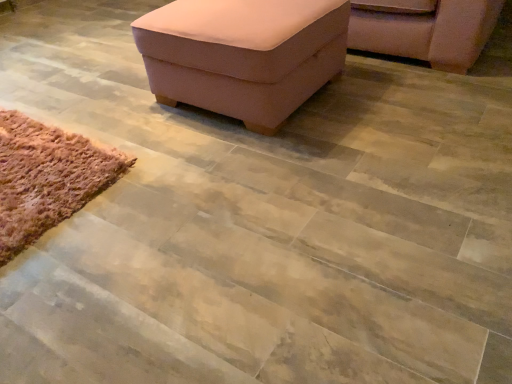
Question: Considering the relative positions of pink fabric ottoman at upper center and pink fabric chair at upper right in the image provided, is pink fabric ottoman at upper center to the left of pink fabric chair at upper right from the viewer's perspective?

Choices:
 (A) yes
 (B) no

Answer: (A)

Question: Is pink fabric ottoman at upper center to the right of pink fabric chair at upper right from the viewer's perspective?

Choices:
 (A) yes
 (B) no

Answer: (B)

Question: Considering the relative sizes of pink fabric ottoman at upper center and pink fabric chair at upper right in the image provided, is pink fabric ottoman at upper center wider than pink fabric chair at upper right?

Choices:
 (A) yes
 (B) no

Answer: (B)

Question: Is pink fabric ottoman at upper center turned away from pink fabric chair at upper right?

Choices:
 (A) no
 (B) yes

Answer: (B)

Question: Does pink fabric ottoman at upper center have a lesser width compared to pink fabric chair at upper right?

Choices:
 (A) no
 (B) yes

Answer: (B)

Question: Is the depth of pink fabric ottoman at upper center greater than that of pink fabric chair at upper right?

Choices:
 (A) yes
 (B) no

Answer: (B)

Question: Is pink fabric chair at upper right touching pink fabric ottoman at upper center?

Choices:
 (A) yes
 (B) no

Answer: (B)

Question: Does pink fabric chair at upper right have a lesser height compared to pink fabric ottoman at upper center?

Choices:
 (A) yes
 (B) no

Answer: (A)

Question: Can you confirm if pink fabric chair at upper right is positioned to the left of pink fabric ottoman at upper center?

Choices:
 (A) yes
 (B) no

Answer: (B)

Question: From the image's perspective, does pink fabric chair at upper right appear higher than pink fabric ottoman at upper center?

Choices:
 (A) no
 (B) yes

Answer: (B)

Question: Is pink fabric chair at upper right at the right side of pink fabric ottoman at upper center?

Choices:
 (A) no
 (B) yes

Answer: (B)

Question: Is pink fabric chair at upper right completely or partially outside of pink fabric ottoman at upper center?

Choices:
 (A) yes
 (B) no

Answer: (A)

Question: Considering the relative sizes of brown fuzzy rug at lower left and pink fabric ottoman at upper center in the image provided, is brown fuzzy rug at lower left smaller than pink fabric ottoman at upper center?

Choices:
 (A) no
 (B) yes

Answer: (B)